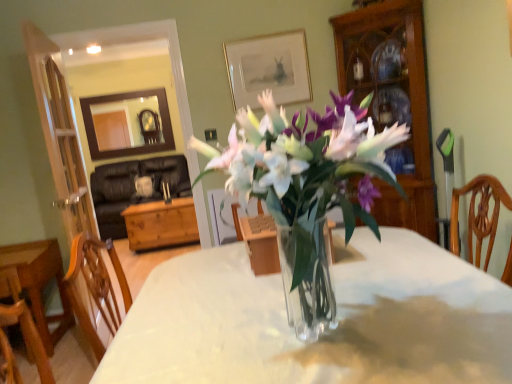
Identify the location of vacant area located to the right-hand side of clear glass vase at center. (442, 309).